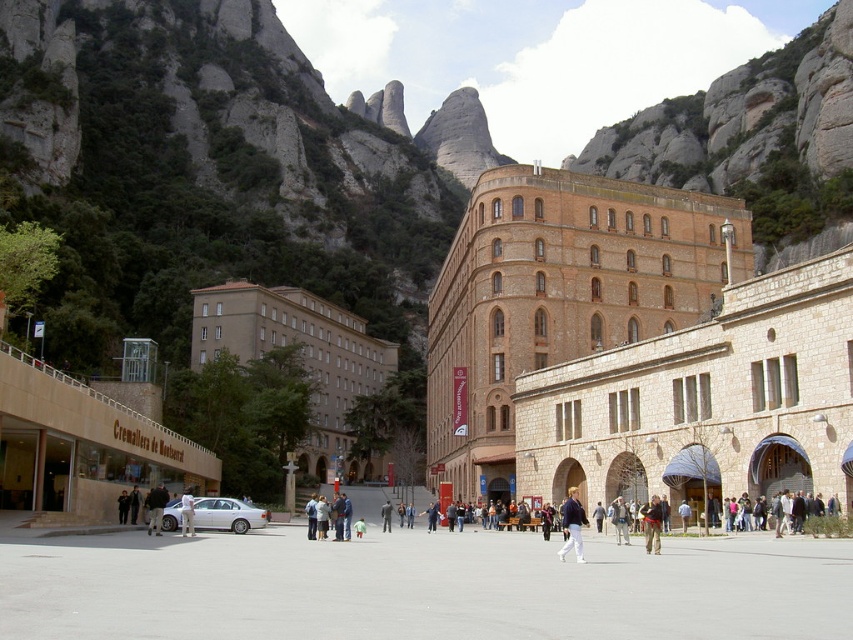
Question: Which point is farther to the camera?

Choices:
 (A) (578, 525)
 (B) (643, 536)
 (C) (619, 509)

Answer: (C)

Question: Is khaki cotton pants at center to the right of light brown leather jacket at center from the viewer's perspective?

Choices:
 (A) yes
 (B) no

Answer: (A)

Question: Does white matte sedan at center appear on the right side of khaki cotton pants at center?

Choices:
 (A) no
 (B) yes

Answer: (A)

Question: Considering the real-world distances, which object is closest to the denim jacket at center?

Choices:
 (A) white cotton shirt at center
 (B) khaki cotton pants at center
 (C) dark gray jacket at center
 (D) white matte sedan at center

Answer: (B)

Question: Does khaki cotton pants at center have a greater width compared to light brown leather jacket at center?

Choices:
 (A) yes
 (B) no

Answer: (A)

Question: Which object is the farthest from the denim jacket at center?

Choices:
 (A) light brown leather jacket at center
 (B) dark gray jacket at center

Answer: (B)